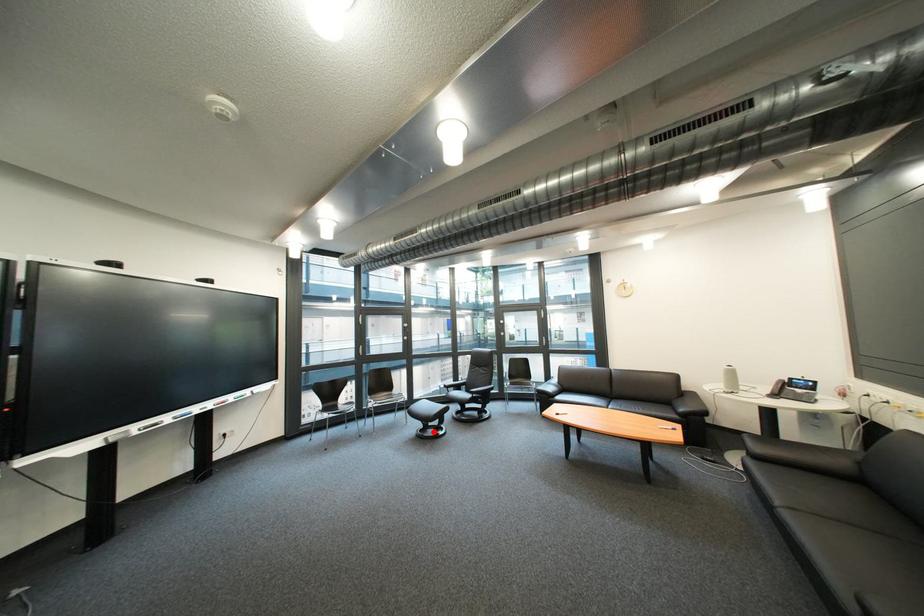
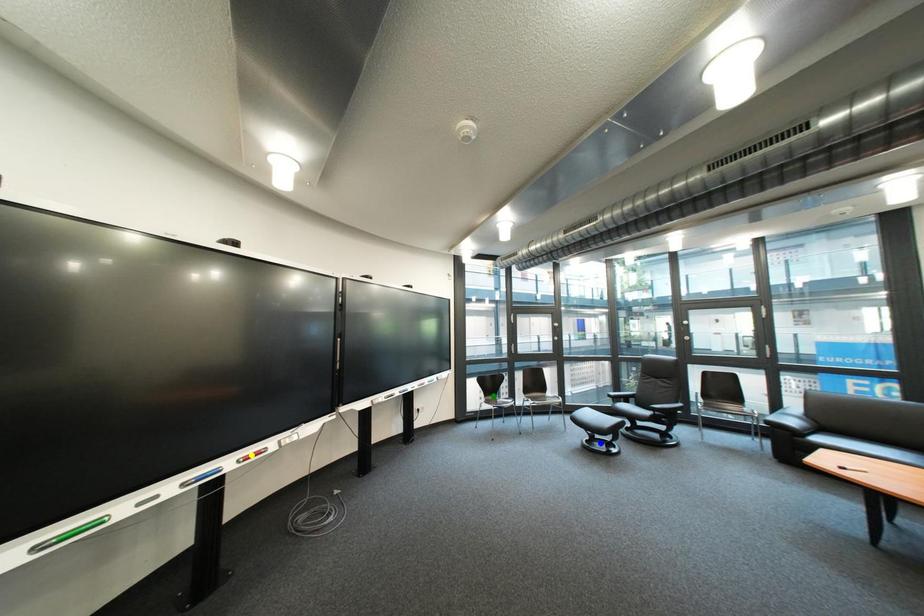
Question: I am providing you with two images of the same scene from different viewpoints. A red point is marked on the first image. You are given multiple points on the second image. Which spot in image 2 lines up with the point in image 1?

Choices:
 (A) green point
 (B) blue point
 (C) yellow point

Answer: (B)